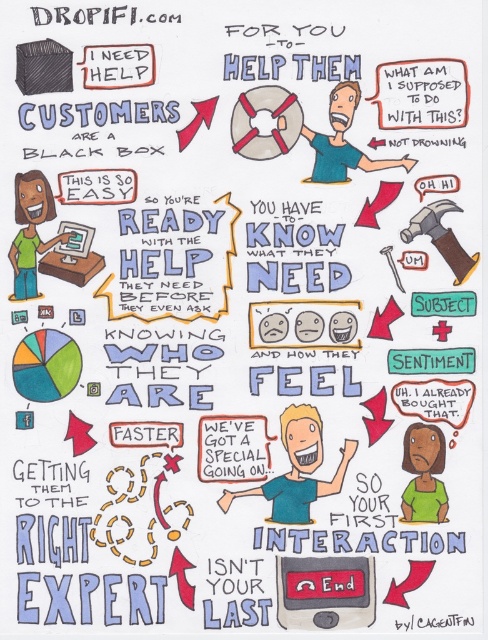
Consider the image. Does light blue shirt at center appear under matte gray life preserver at center?

Indeed, light blue shirt at center is positioned under matte gray life preserver at center.

What do you see at coordinates (298, 468) in the screenshot? I see `light blue shirt at center` at bounding box center [298, 468].

Find the location of a particular element. light blue shirt at center is located at coordinates (298, 468).

This screenshot has height=640, width=488. I want to click on light blue shirt at center, so click(298, 468).

In the scene shown: Between light blue shirt at center and matte green shirt at lower right, which one appears on the right side from the viewer's perspective?

From the viewer's perspective, matte green shirt at lower right appears more on the right side.

Identify the location of light blue shirt at center. (298, 468).

Is point (302, 497) closer to viewer compared to point (406, 435)?

No, (302, 497) is behind (406, 435).

At what (x,y) coordinates should I click in order to perform the action: click on light blue shirt at center. Please return your answer as a coordinate pair (x, y). This screenshot has width=488, height=640. Looking at the image, I should click on (298, 468).

Between point (345, 128) and point (442, 504), which one is positioned in front?

Point (442, 504)

Who is positioned more to the right, blue shirt at center or matte green shirt at lower right?

Positioned to the right is matte green shirt at lower right.

What do you see at coordinates (343, 140) in the screenshot? I see `blue shirt at center` at bounding box center [343, 140].

Where is `blue shirt at center`? The image size is (488, 640). blue shirt at center is located at coordinates (343, 140).